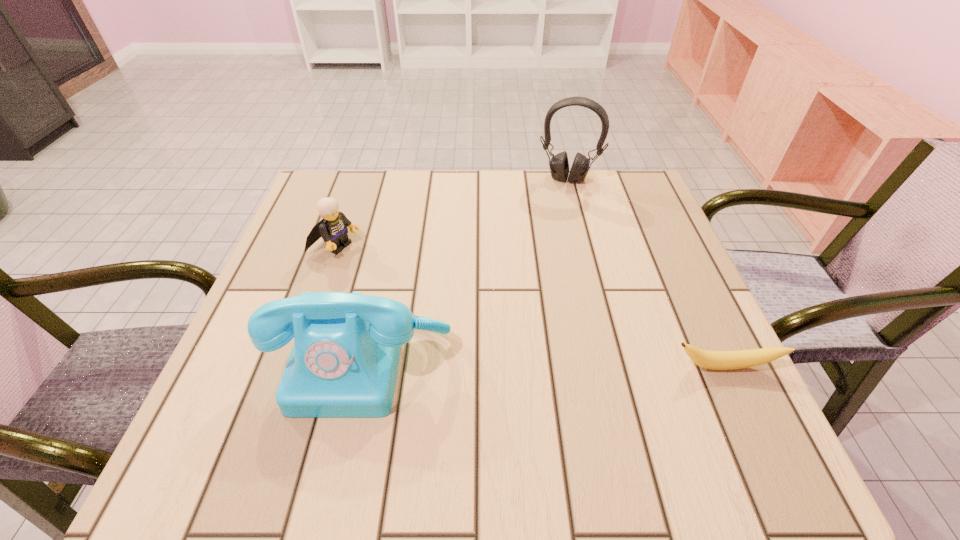
Locate an element on the screen. This screenshot has width=960, height=540. headset situated at the right edge is located at coordinates (559, 166).

You are a GUI agent. You are given a task and a screenshot of the screen. Output one action in this format:
    pyautogui.click(x=<x>, y=<y>)
    Task: Click on the object at the near left corner
    
    Given the screenshot: What is the action you would take?
    pyautogui.click(x=344, y=361)

At what (x,y) coordinates should I click in order to perform the action: click on object present at the far right corner. Please return your answer as a coordinate pair (x, y). The height and width of the screenshot is (540, 960). Looking at the image, I should click on (559, 166).

Where is `object located in the near right corner section of the desktop`? object located in the near right corner section of the desktop is located at coordinates (715, 360).

In the image, there is a desktop. In order to click on vacant space at the far edge in this screenshot , I will do `click(576, 205)`.

Locate an element on the screen. This screenshot has width=960, height=540. vacant region at the near edge of the desktop is located at coordinates (432, 415).

The width and height of the screenshot is (960, 540). Identify the location of vacant area at the left edge of the desktop. click(286, 259).

Locate an element on the screen. free space at the right edge of the desktop is located at coordinates 621,298.

Where is `free space at the far right corner of the desktop`? free space at the far right corner of the desktop is located at coordinates (615, 220).

The image size is (960, 540). I want to click on vacant space at the near right corner, so click(695, 390).